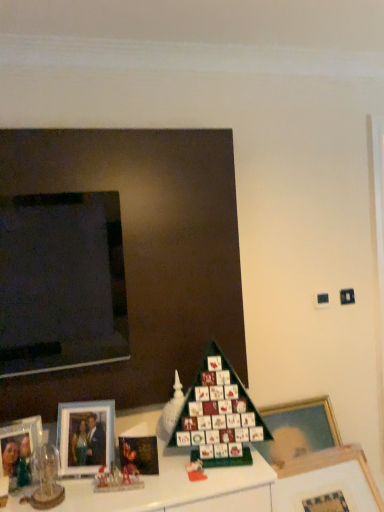
Locate an element on the screen. This screenshot has height=512, width=384. vacant space that is in between matte black picture frame at lower left, acting as the 2th picture frame starting from the right, and matte plastic toy at lower center is located at coordinates (172, 468).